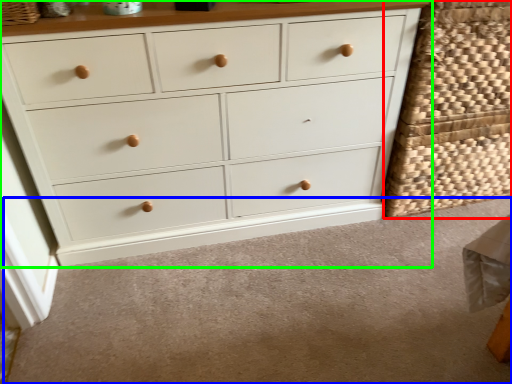
Question: Which is farther away from basket (highlighted by a red box)? plain (highlighted by a blue box) or chest of drawers (highlighted by a green box)?

Choices:
 (A) plain
 (B) chest of drawers

Answer: (A)